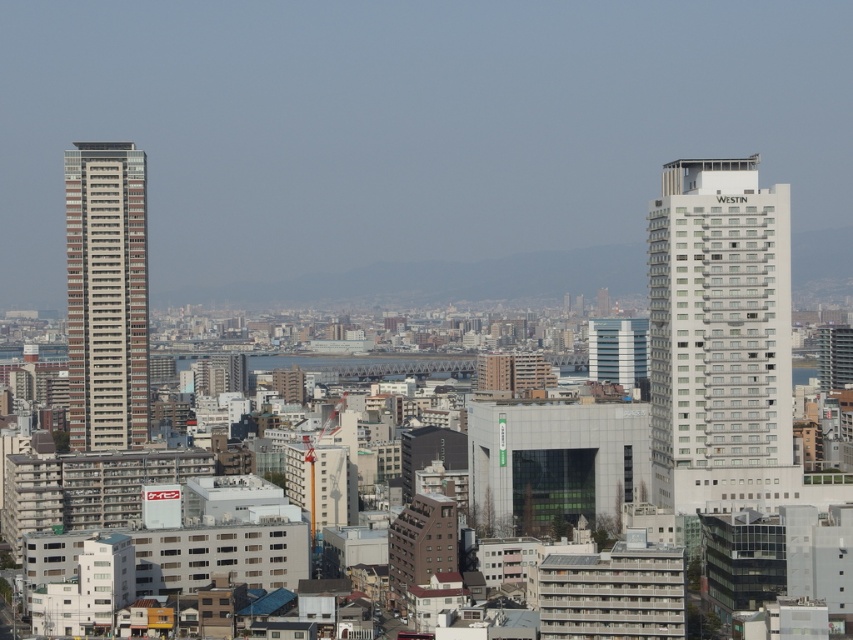
You are standing at the center of the city and looking at the two points marked in the image. Which point, point (782, 317) or point (126, 204), is closer to your current position?

Point (782, 317) is closer to the camera than point (126, 204), so it is closer to your current position.

You are standing at the observation deck of the city and want to take a photo of both the white glossy hotel at right and the brown textured building at left. Which one should you zoom in on first to ensure both are in frame?

You should zoom in on the brown textured building at left first because it is farther away from you than the white glossy hotel at right, so adjusting the zoom to include the farther building ensures both are in frame.

You are a city planner reviewing this cityscape. You need to determine the spatial relationship between the white glossy hotel at right and the brown textured building at left. Which one is located to the right of the other?

The white glossy hotel at right is positioned on the right side of the brown textured building at left.